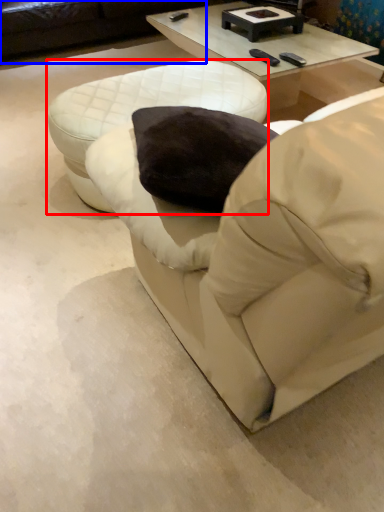
Question: Among these objects, which one is farthest to the camera, table (highlighted by a red box) or studio couch (highlighted by a blue box)?

Choices:
 (A) table
 (B) studio couch

Answer: (B)